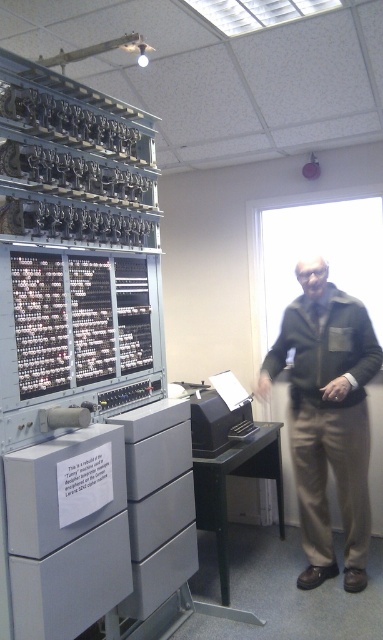
You are a tour guide leading a group through the museum. You want to show the group the gray plastic drawer at lower center from a closer distance. Considering the current distance between you and the drawer, can you move forward to get within 5 feet of it without any obstruction?

The gray plastic drawer at lower center is currently 7.58 feet away from the camera. Moving forward to within 5 feet would require closing the gap by approximately 2.58 feet. Since there is no mention of obstacles in the scene description, it should be possible to approach closer.

You are standing in front of the Tunny machine and need to reach both the point at coordinates point (144, 572) and point (139, 477). Which point is closer to you?

Point (144, 572) is closer to you because it is further to the viewer than point (139, 477).

You are a visitor at the museum and want to take a photo of the Tunny machine. You notice two points marked on the floor in front of the machine. The first point is at coordinate point(158, 602) and the second at point(142, 516). Which point should you stand on to get a closer view of the machine?

You should stand on point(158, 602) because it is closer to the machine than point(142, 516).